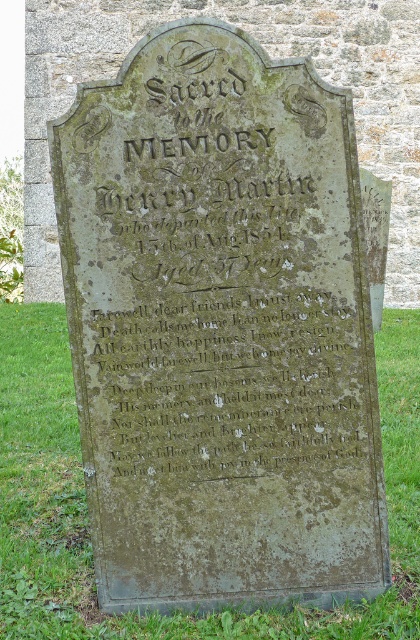
Which of these two, green grass at lower center or green mossy stone inscription at center, stands shorter?

Standing shorter between the two is green grass at lower center.

Looking at this image, is green grass at lower center below green mossy stone inscription at center?

Indeed, green grass at lower center is positioned under green mossy stone inscription at center.

Image resolution: width=420 pixels, height=640 pixels. Describe the element at coordinates (86, 513) in the screenshot. I see `green grass at lower center` at that location.

The image size is (420, 640). Find the location of `green grass at lower center`. green grass at lower center is located at coordinates (86, 513).